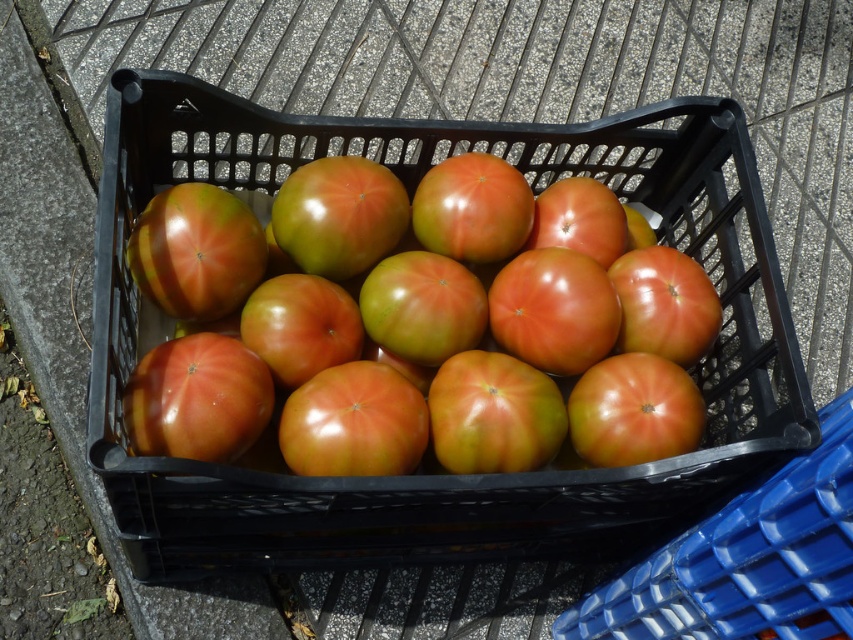
Question: Which object is closer to the camera taking this photo?

Choices:
 (A) shiny red tomato at center
 (B) matte black basket at center

Answer: (B)

Question: Does matte black basket at center have a smaller size compared to shiny red tomato at center?

Choices:
 (A) yes
 (B) no

Answer: (B)

Question: Which of the following is the farthest from the observer?

Choices:
 (A) matte black basket at center
 (B) shiny red tomato at center

Answer: (B)

Question: Can you confirm if matte black basket at center is bigger than shiny red tomato at center?

Choices:
 (A) no
 (B) yes

Answer: (B)

Question: Which point appears farthest from the camera in this image?

Choices:
 (A) (335, 116)
 (B) (252, 220)

Answer: (A)

Question: From the image, what is the correct spatial relationship of matte black basket at center in relation to shiny red tomato at center?

Choices:
 (A) above
 (B) below

Answer: (B)